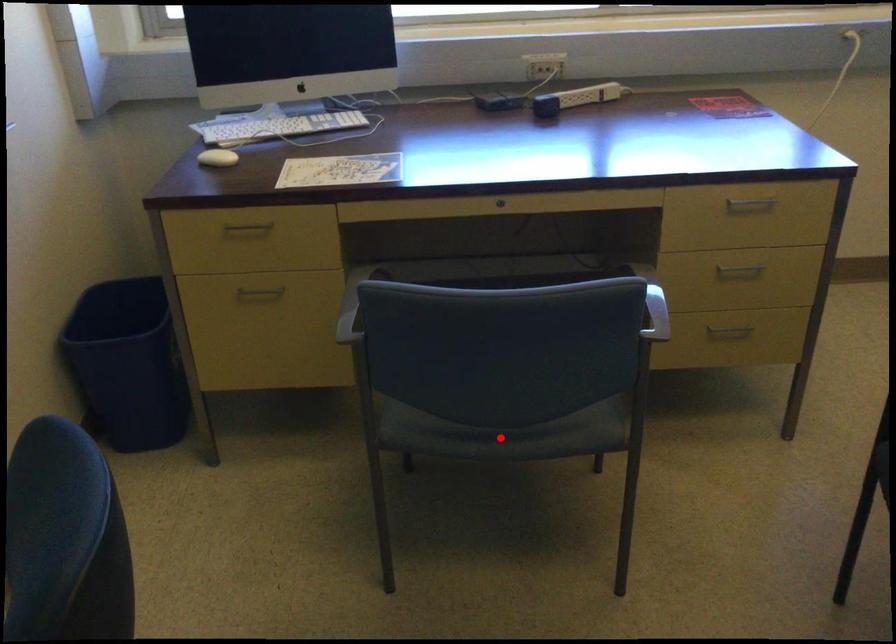
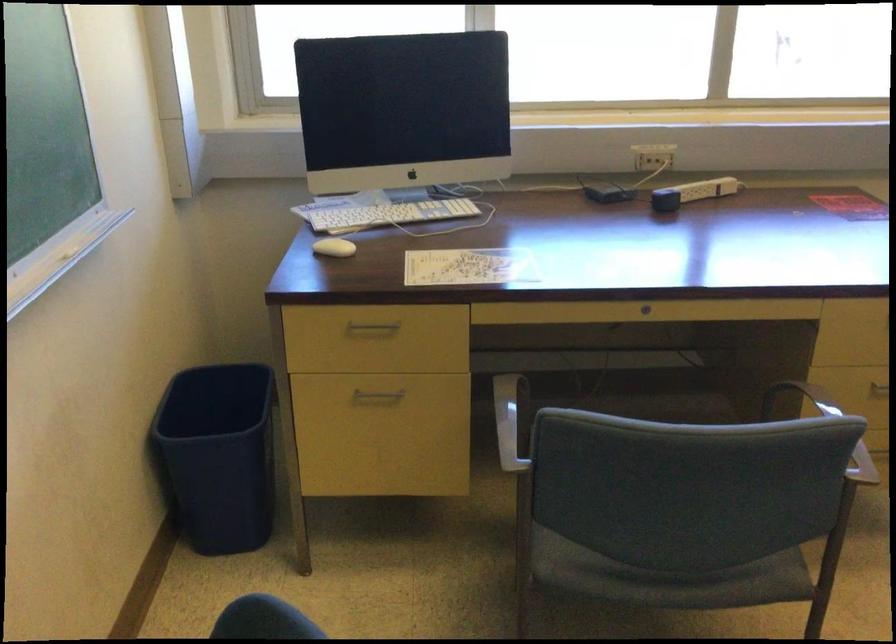
Question: I am providing you with two images of the same scene from different viewpoints. Given a red point in image1, look at the same physical point in image2. Is it:

Choices:
 (A) Closer to the viewpoint
 (B) Farther from the viewpoint

Answer: (A)